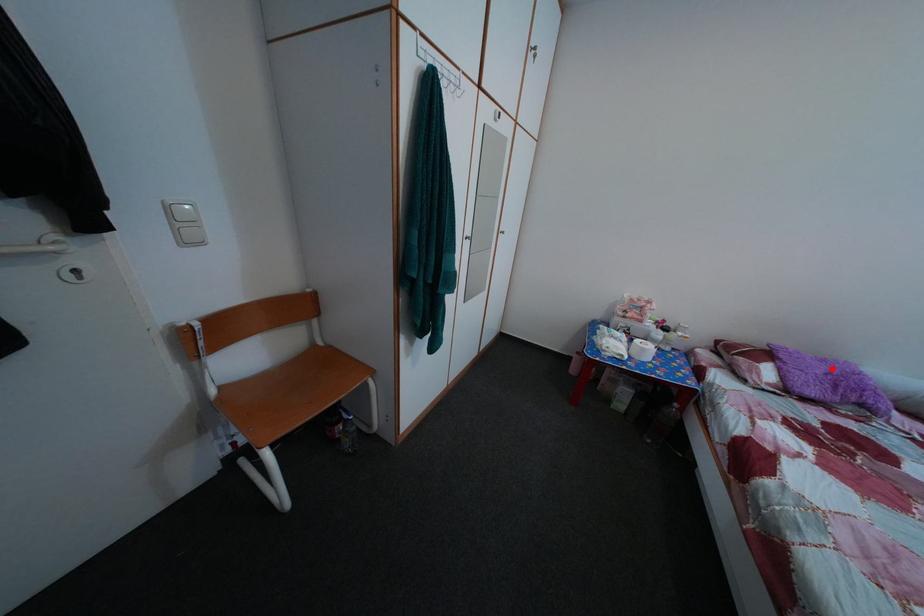
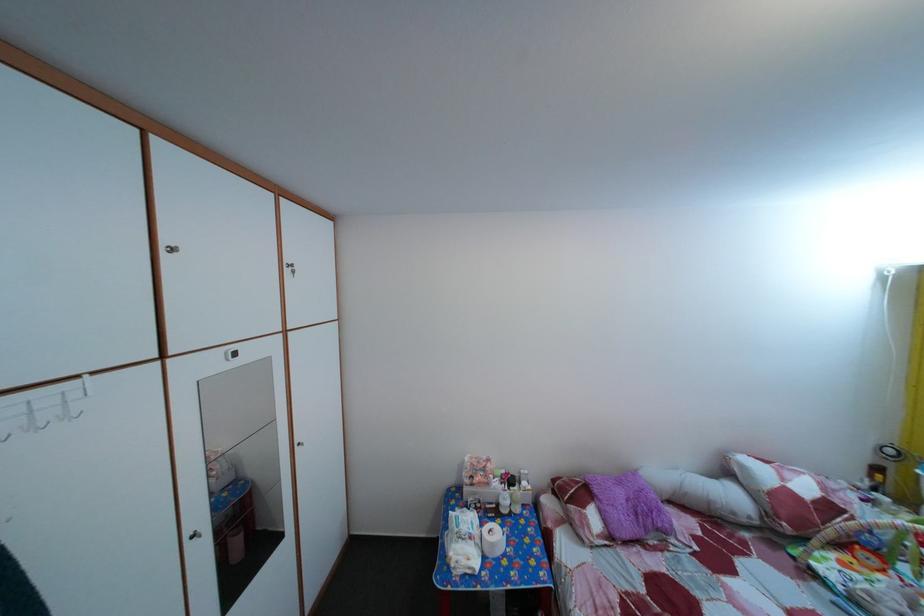
Where in the second image is the point corresponding to the highlighted location from the first image?

(629, 491)